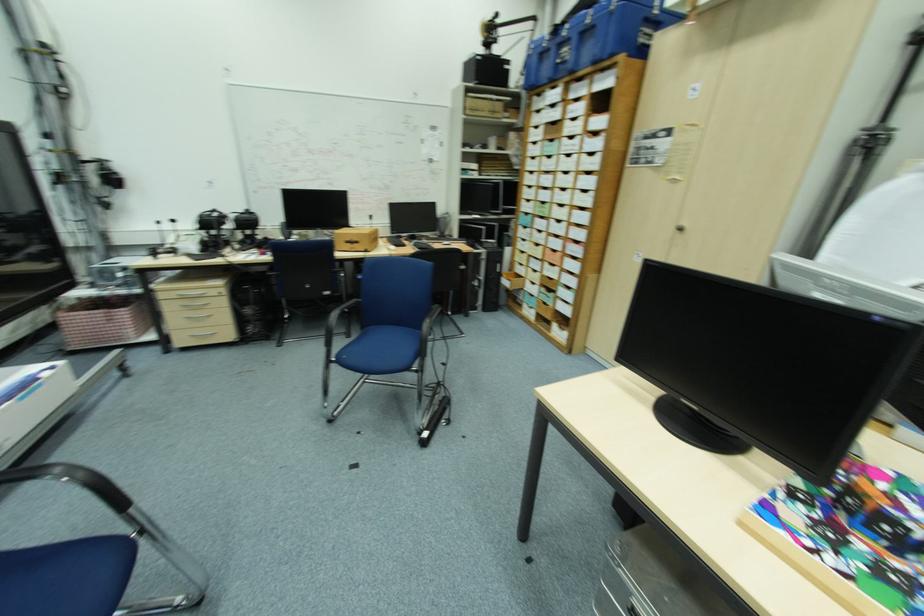
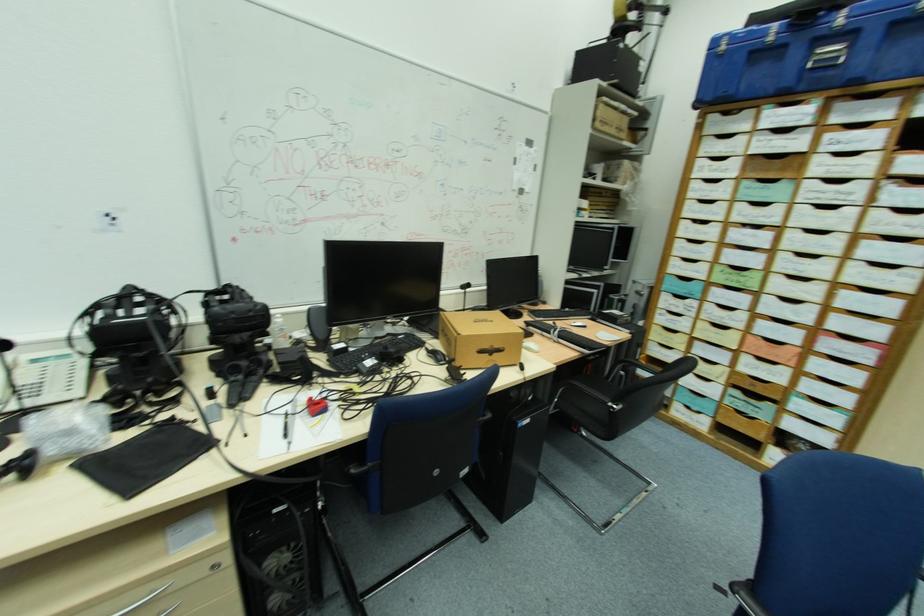
What movement of the cameraman would produce the second image?

The movement direction of the cameraman is left, forward.